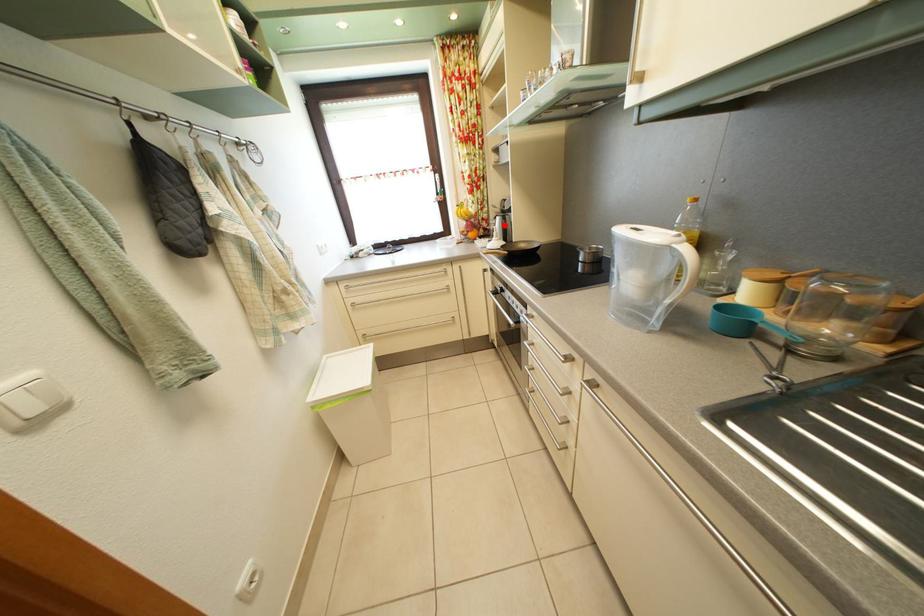
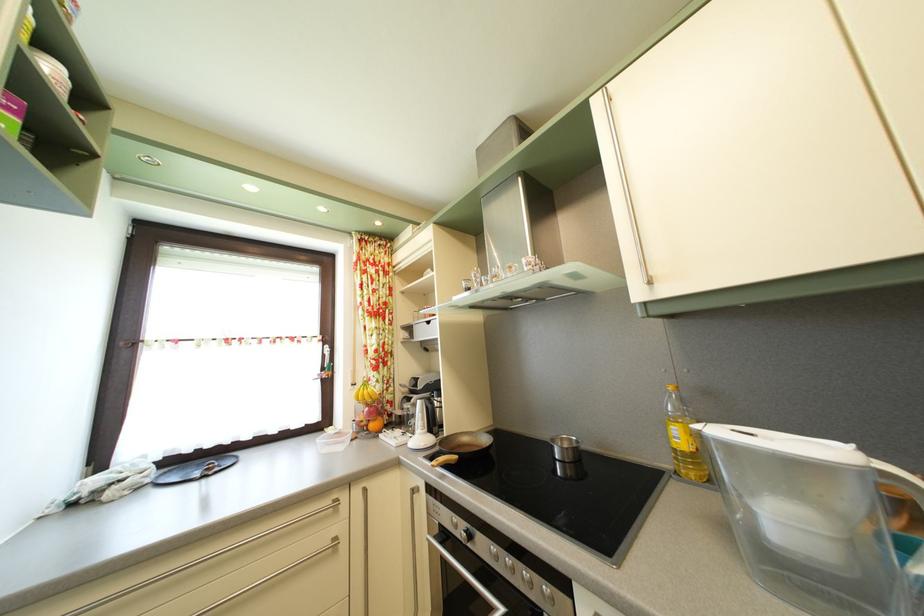
Where in the second image is the point corresponding to the highlighted location from the first image?

(417, 407)